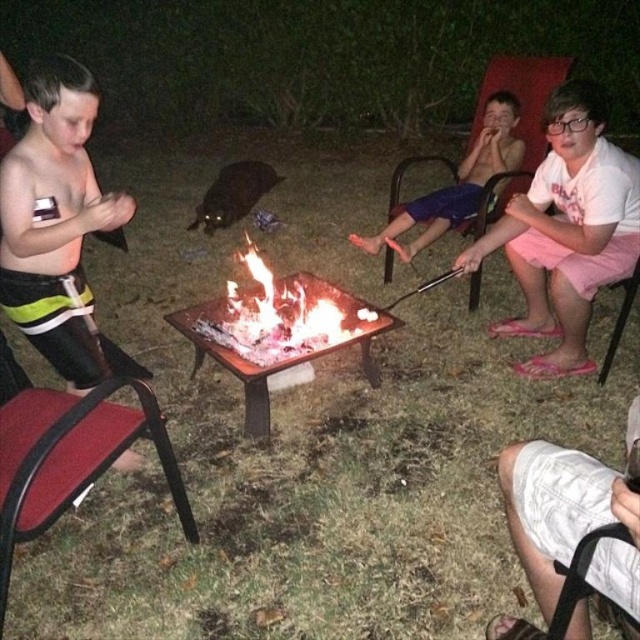
Between point (556, 468) and point (506, 198), which one is positioned in front?

Positioned in front is point (556, 468).

Locate an element on the screen. The image size is (640, 640). white cotton shorts at lower right is located at coordinates (568, 520).

This screenshot has height=640, width=640. What are the coordinates of `pink fabric chair at upper right` in the screenshot? It's located at (516, 122).

Between point (536, 125) and point (480, 154), which one is positioned in front?

Point (536, 125) is more forward.

Between point (394, 173) and point (417, 246), which one is positioned in front?

Point (394, 173) is more forward.

Image resolution: width=640 pixels, height=640 pixels. Identify the location of pink fabric chair at upper right. (516, 122).

Consider the image. Does black matte shorts at left have a greater width compared to blue shorts at center?

Incorrect, black matte shorts at left's width does not surpass blue shorts at center's.

Can you confirm if black matte shorts at left is positioned above blue shorts at center?

No.

Who is more distant from viewer, (x=72, y=234) or (x=355, y=244)?

The point (x=355, y=244) is behind.

The image size is (640, 640). I want to click on black matte shorts at left, so click(54, 218).